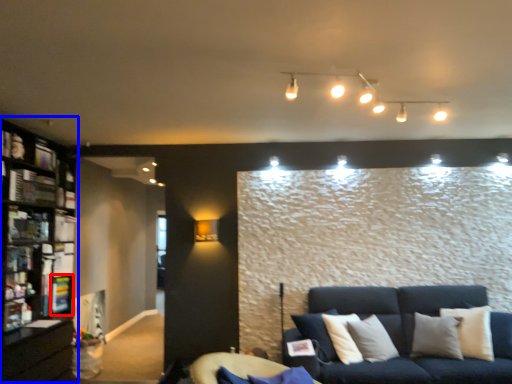
Question: Which object is closer to the camera taking this photo, shelf (highlighted by a red box) or bookcase (highlighted by a blue box)?

Choices:
 (A) shelf
 (B) bookcase

Answer: (B)